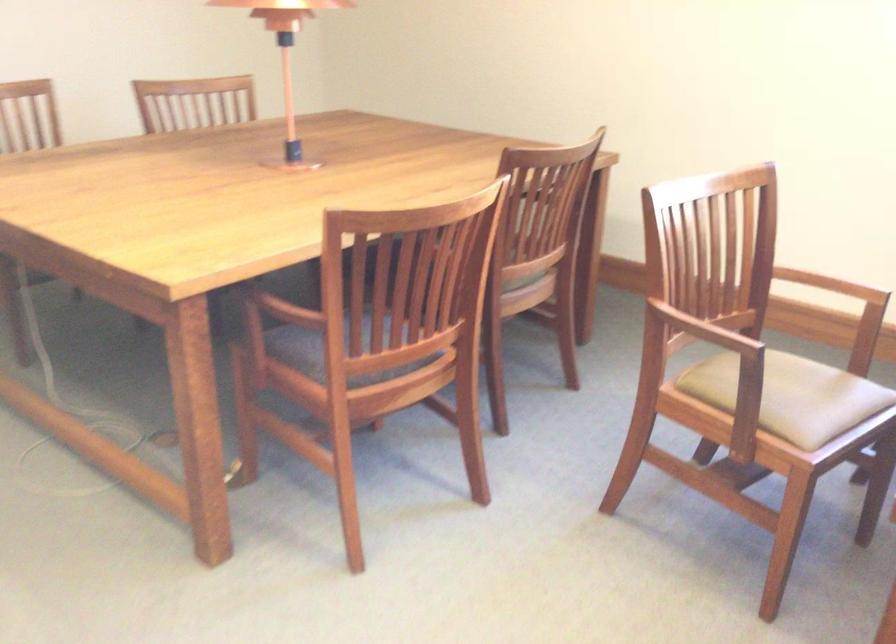
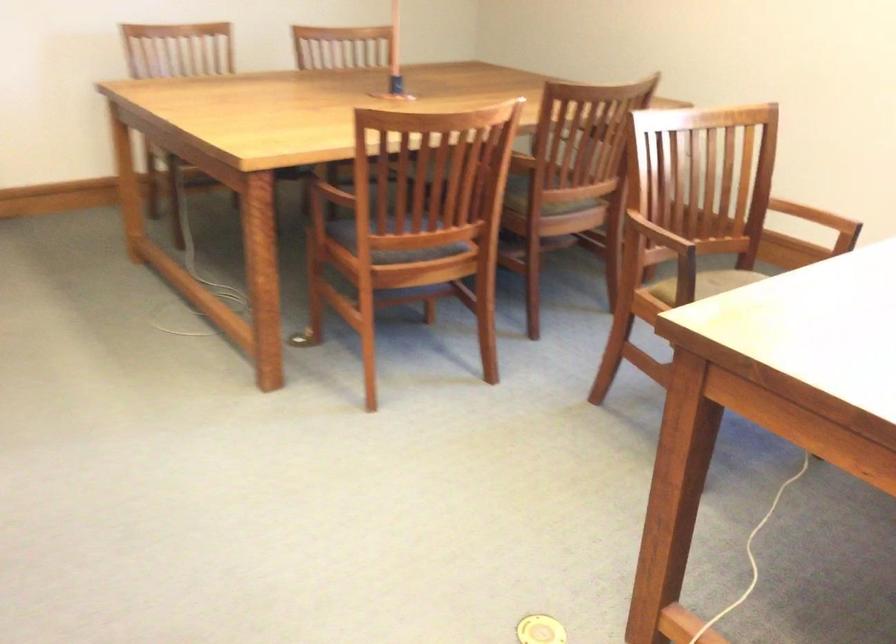
Question: The camera is either moving clockwise (left) or counter-clockwise (right) around the object. The first image is from the beginning of the video and the second image is from the end. Is the camera moving left or right when shooting the video?

Choices:
 (A) Left
 (B) Right

Answer: (B)